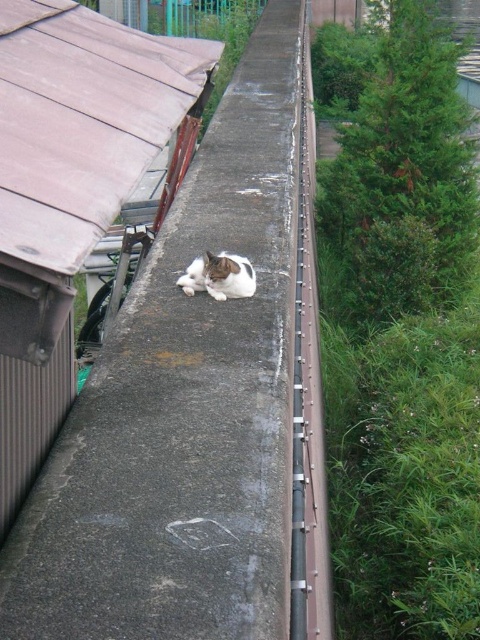
Looking at this image, you are standing in front of the scene and want to know where the gray concrete ledge at center is located. Based on the coordinate system where the bottom left corner is the origin, can you determine its position?

The gray concrete ledge at center is located at the 2D coordinate point of (200, 406).